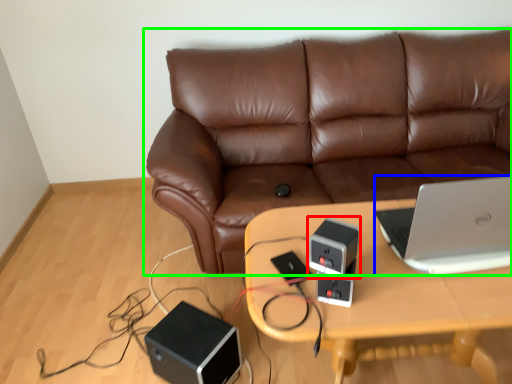
Question: Based on their relative distances, which object is nearer to speaker (highlighted by a red box)? Choose from laptop (highlighted by a blue box) and studio couch (highlighted by a green box).

Choices:
 (A) laptop
 (B) studio couch

Answer: (A)